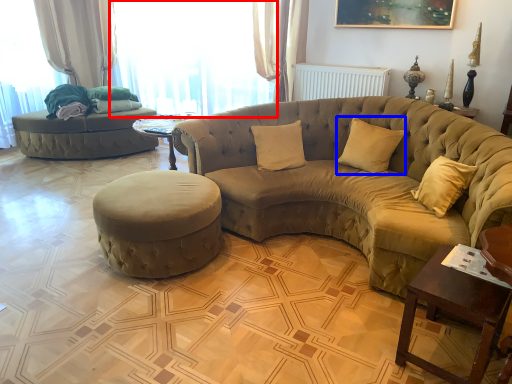
Question: Which object appears farthest to the camera in this image, window (highlighted by a red box) or pillow (highlighted by a blue box)?

Choices:
 (A) window
 (B) pillow

Answer: (A)